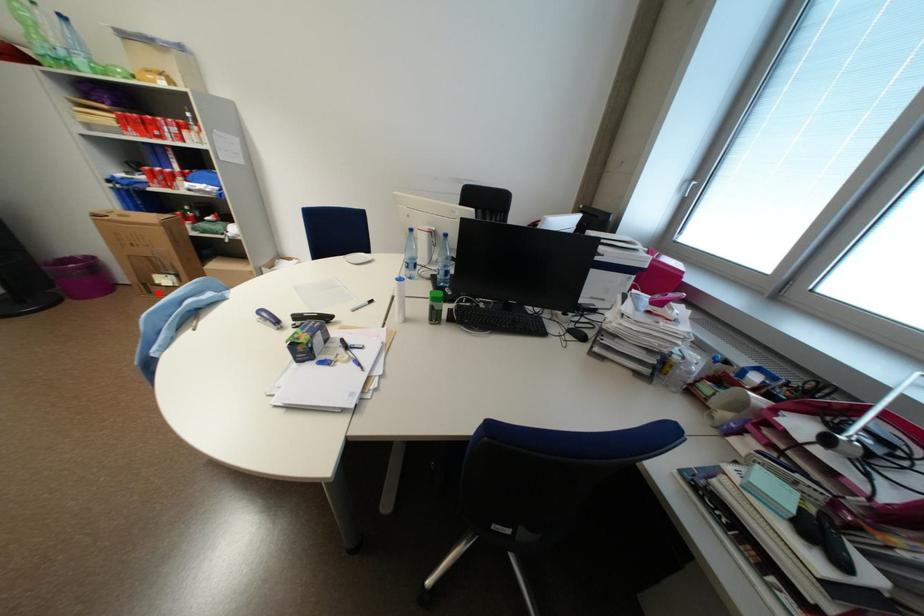
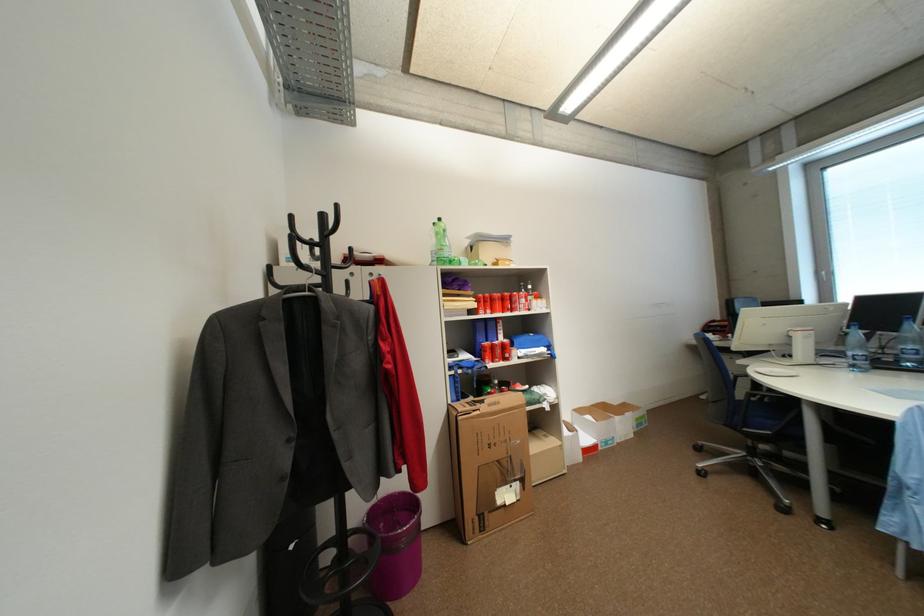
Question: A red point is marked in image1. In image2, is the corresponding 3D point closer to the camera or farther? Reply with the corresponding letter.

Choices:
 (A) The corresponding 3D point is closer.
 (B) The corresponding 3D point is farther.

Answer: (B)